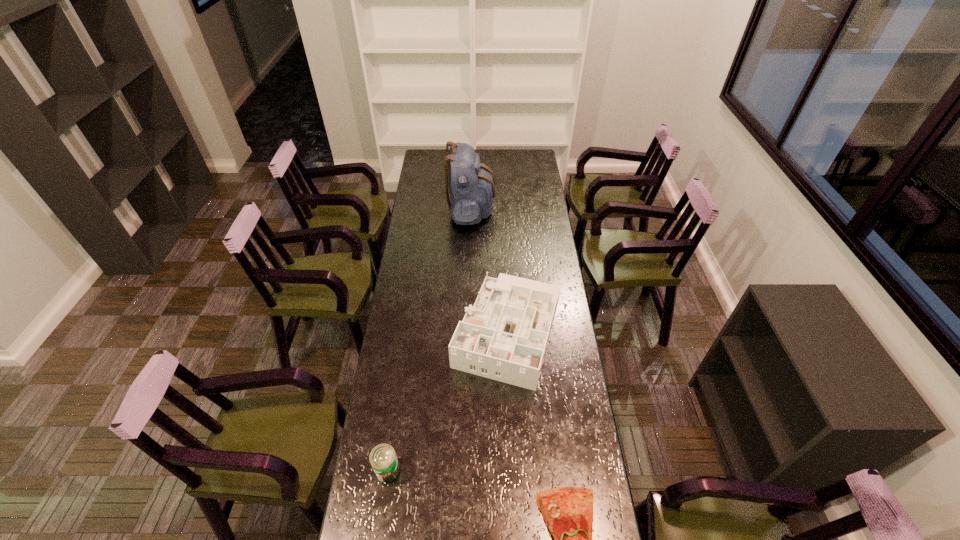
Identify the location of backpack. (471, 184).

Find the location of `the farthest object`. the farthest object is located at coordinates (471, 184).

Image resolution: width=960 pixels, height=540 pixels. In order to click on the second farthest object in this screenshot , I will do `click(504, 336)`.

Identify the location of the third shortest object. This screenshot has height=540, width=960. (504, 336).

Locate an element on the screen. The width and height of the screenshot is (960, 540). the leftmost object is located at coordinates [383, 459].

Locate an element on the screen. The height and width of the screenshot is (540, 960). can is located at coordinates (383, 459).

This screenshot has height=540, width=960. In order to click on free space located 0.130m at the front pocket of the backpack in this screenshot , I will do `click(518, 208)`.

Find the location of a particular element. This screenshot has height=540, width=960. free space located on the front of the third shortest object is located at coordinates (516, 457).

The width and height of the screenshot is (960, 540). I want to click on vacant position located 0.250m on the back of the second shortest object, so click(x=398, y=391).

The width and height of the screenshot is (960, 540). Find the location of `object located at the left edge`. object located at the left edge is located at coordinates (383, 459).